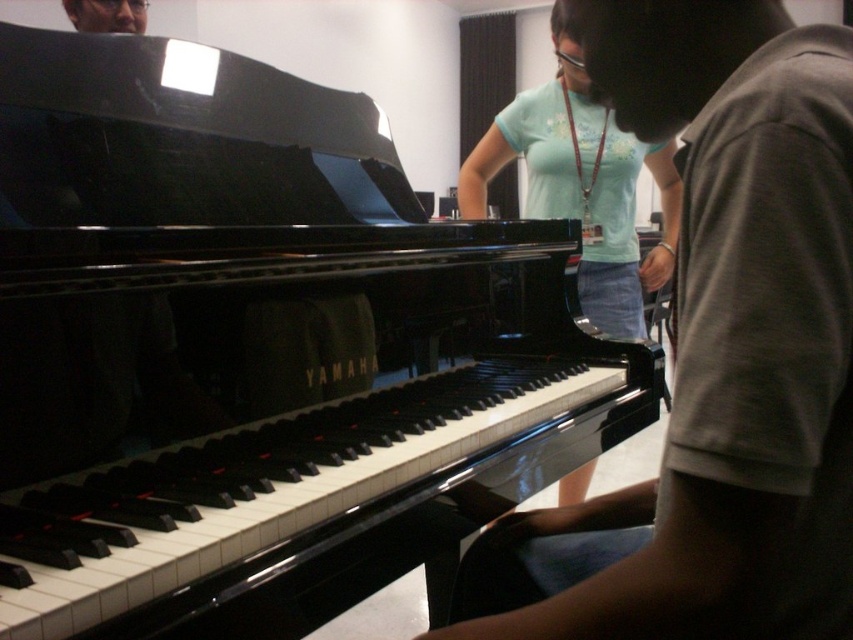
You are standing in the music room and want to place a new music stand exactly at the location marked by the point (730,339). Is this point near the matte black piano at left?

The matte black piano at left is located at point (730,339), so yes, placing the music stand there would be directly at the location of the matte black piano at left.

You are standing in front of the Yamaha grand piano in the music room. There is a point at coordinates [706,196] that you need to reach. If your hand is 15 centimeters long, can you comfortably reach that point without moving your feet?

The point at [706,196] is 52.01 centimeters away from the viewer. Since your hand is only 15 centimeters long, you cannot comfortably reach that point without moving your feet.